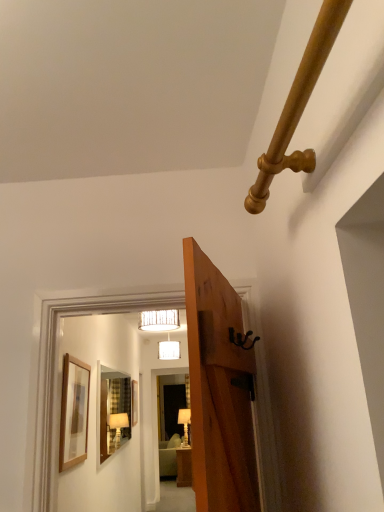
Question: Which is correct: wooden door at center is inside wooden picture frame at center, marked as the second picture frame in a top-to-bottom arrangement, or outside of it?

Choices:
 (A) outside
 (B) inside

Answer: (A)

Question: From the image's perspective, relative to wooden picture frame at center, the 2th picture frame when ordered from front to back, is wooden door at center above or below?

Choices:
 (A) above
 (B) below

Answer: (A)

Question: Estimate the real-world distances between objects in this image. Which object is farther from the wooden framed picture at left, the second picture frame in the back-to-front sequence?

Choices:
 (A) clear glass mirror at center
 (B) white fabric lampshade at upper center, the 2th lamp in the bottom-to-top sequence
 (C) wooden door at center
 (D) wooden picture frame at center, positioned as the first picture frame in bottom-to-top order
 (E) gold polished pipe at upper right

Answer: (B)

Question: Estimate the real-world distances between objects in this image. Which object is farther from the wooden framed picture at left, the second picture frame in the back-to-front sequence?

Choices:
 (A) gold polished pipe at upper right
 (B) clear glass mirror at center
 (C) black matte door handle at upper right
 (D) white fabric lampshade at upper center, which ranks as the second lamp in front-to-back order
 (E) wooden picture frame at center, the 2th picture frame from the right

Answer: (D)